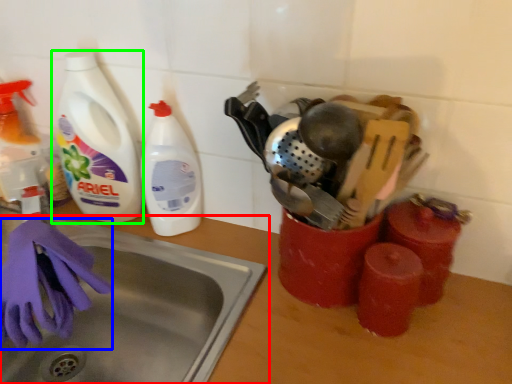
Question: Considering the real-world distances, which object is closest to sink (highlighted by a red box)? glove (highlighted by a blue box) or bottle (highlighted by a green box).

Choices:
 (A) glove
 (B) bottle

Answer: (A)